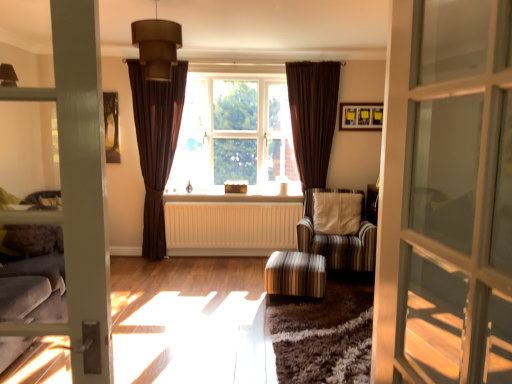
Find the location of a particular element. This screenshot has width=512, height=384. vacant region above white textured radiator at center (from a real-world perspective) is located at coordinates (245, 200).